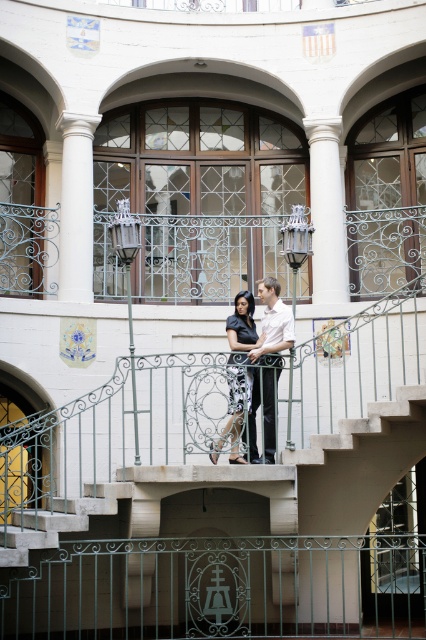
You are standing on the balcony and want to place a small potted plant between the green wrought iron railing at center and the matte black dress at center. Based on their positions, which object should the plant be closer to?

The green wrought iron railing at center is to the right of the matte black dress at center, so the plant should be placed closer to the green wrought iron railing at center if you want it between them.

You are an architect designing a new balcony for a historic building. You need to place a decorative lantern exactly where the white glossy shirt at center is currently located. What are the coordinates for placing the lantern?

The coordinates for placing the decorative lantern should be at point (x=268, y=364), where the white glossy shirt at center is positioned.

Based on the photo, you are a photographer trying to capture the couple on the balcony. You notice the white glossy shirt at center and the matte black dress at center. Which clothing item is located to the right of the other?

The white glossy shirt at center is positioned on the right side of matte black dress at center.